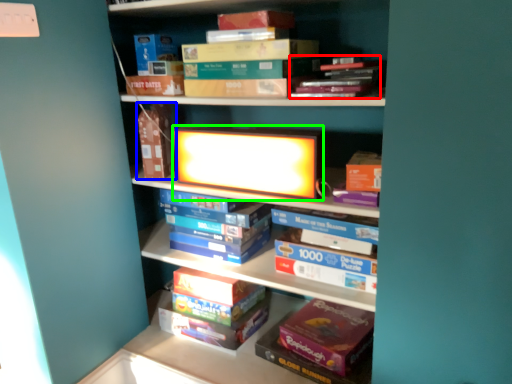
Question: Which object is positioned closest to book (highlighted by a red box)? Select from paperback book (highlighted by a blue box) and book cover (highlighted by a green box).

Choices:
 (A) paperback book
 (B) book cover

Answer: (B)